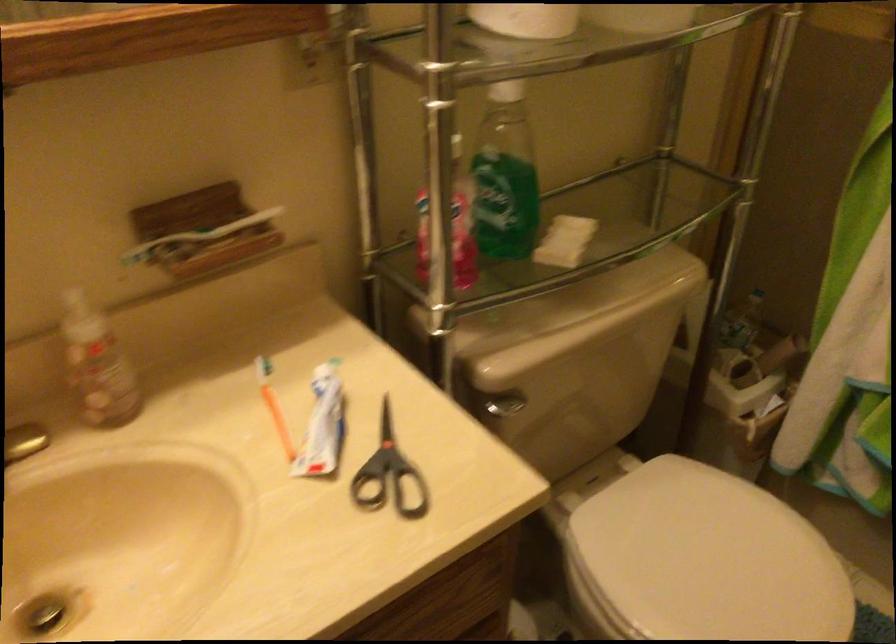
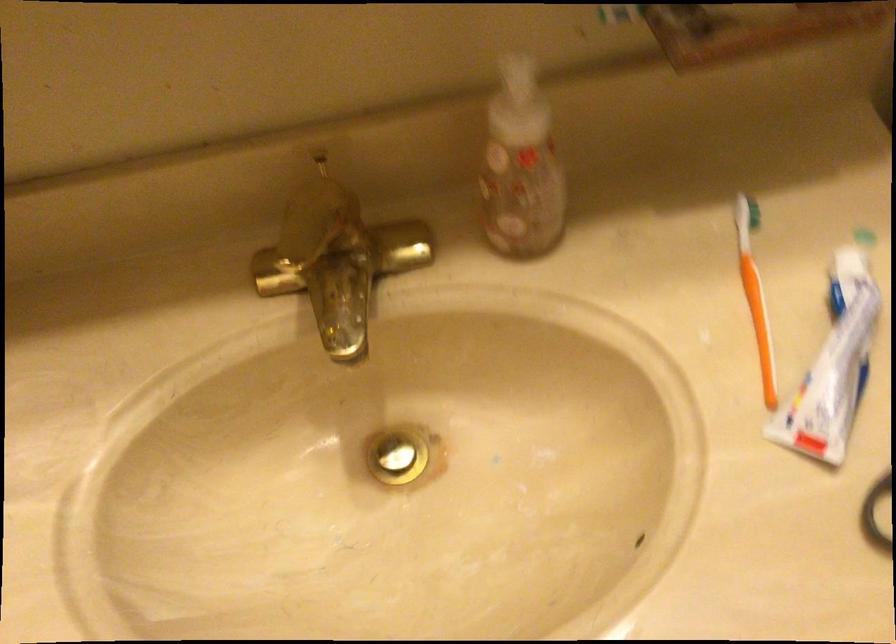
The point at [328,424] is marked in the first image. Where is the corresponding point in the second image?

(833, 366)